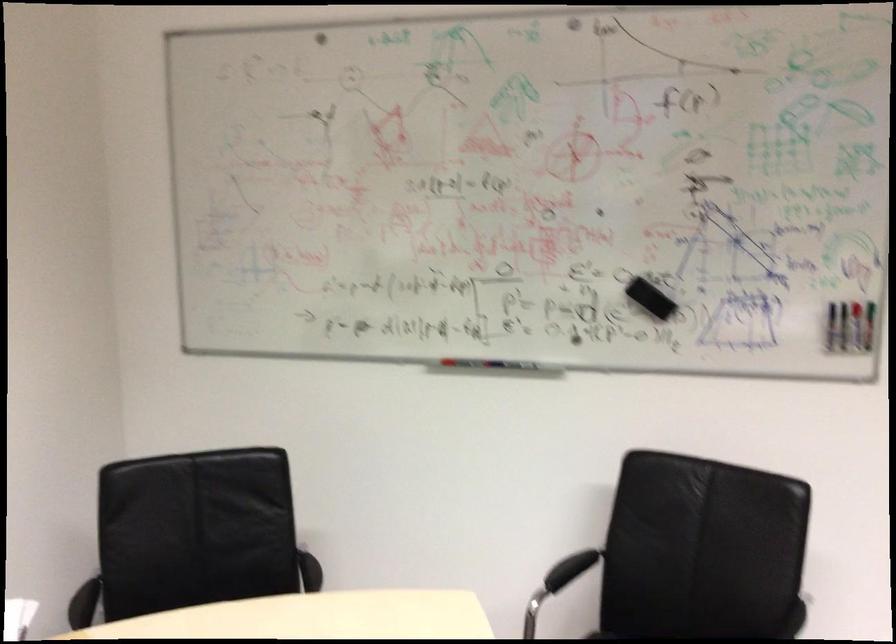
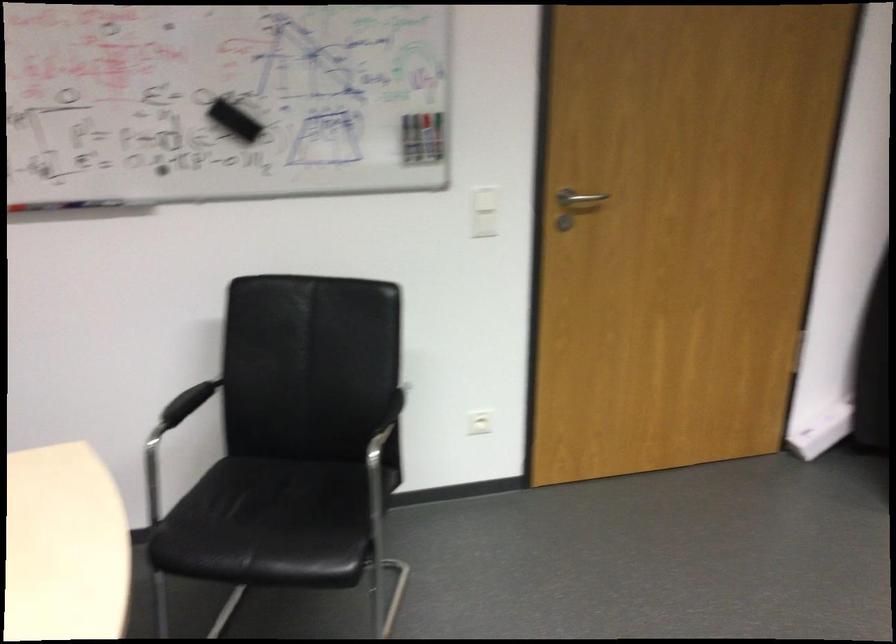
Question: Based on the continuous images, in which direction is the camera rotating? Reply with the corresponding letter.

Choices:
 (A) Left
 (B) Right
 (C) Up
 (D) Down

Answer: (B)